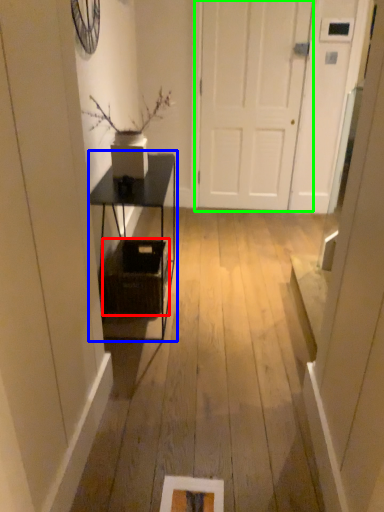
Question: Considering the real-world distances, which object is closest to basket (highlighted by a red box)? table (highlighted by a blue box) or door (highlighted by a green box).

Choices:
 (A) table
 (B) door

Answer: (A)